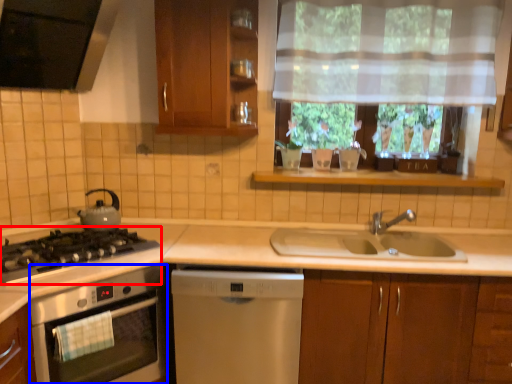
Question: Which point is further to the camera, gas stove (highlighted by a red box) or kitchen appliance (highlighted by a blue box)?

Choices:
 (A) gas stove
 (B) kitchen appliance

Answer: (A)